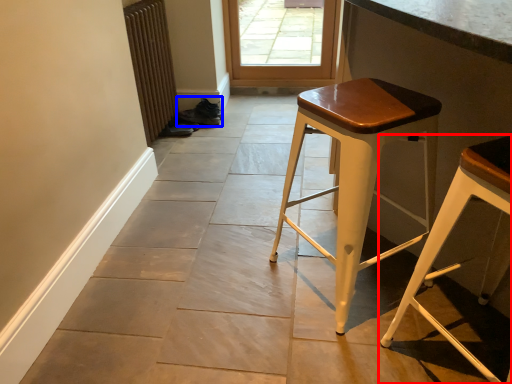
Question: Which of the following is the farthest to the observer, stool (highlighted by a red box) or shoe (highlighted by a blue box)?

Choices:
 (A) stool
 (B) shoe

Answer: (B)